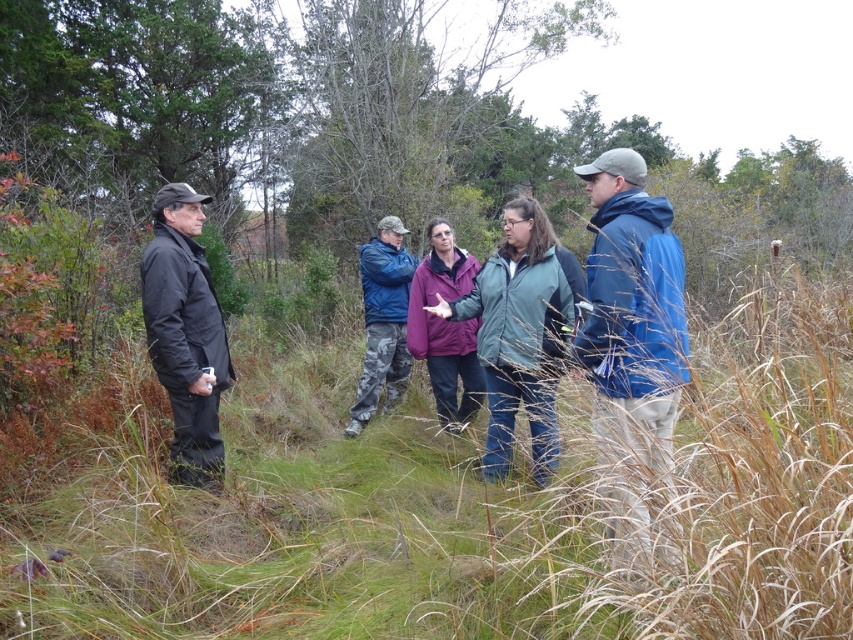
Who is more distant from viewer, (142, 262) or (421, 308)?

Positioned behind is point (421, 308).

Between point (195, 384) and point (477, 378), which one is positioned in front?

Point (195, 384) is more forward.

Measure the distance between black matte jacket at left and camera.

11.73 feet

Find the location of a particular element. The width and height of the screenshot is (853, 640). black matte jacket at left is located at coordinates (184, 333).

Which is more to the right, brown dry grass at center or matte purple jacket at center?

brown dry grass at center

The width and height of the screenshot is (853, 640). What do you see at coordinates (442, 502) in the screenshot?
I see `brown dry grass at center` at bounding box center [442, 502].

Which is in front, point (225, 400) or point (500, 250)?

Point (500, 250)

The image size is (853, 640). Find the location of `brown dry grass at center`. brown dry grass at center is located at coordinates (442, 502).

Can you confirm if purple fleece jacket at center is thinner than camo pants at center?

Yes.

Is purple fleece jacket at center above camo pants at center?

Yes, purple fleece jacket at center is above camo pants at center.

Locate an element on the screen. This screenshot has height=640, width=853. purple fleece jacket at center is located at coordinates click(x=445, y=326).